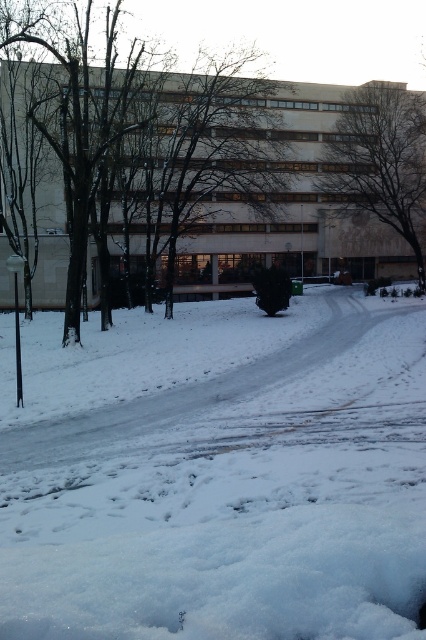
Can you confirm if brown leafless tree at left is positioned to the right of brown textured tree at upper center?

In fact, brown leafless tree at left is to the left of brown textured tree at upper center.

The height and width of the screenshot is (640, 426). Describe the element at coordinates (75, 118) in the screenshot. I see `brown leafless tree at left` at that location.

Locate an element on the screen. The width and height of the screenshot is (426, 640). brown leafless tree at left is located at coordinates (75, 118).

The image size is (426, 640). Identify the location of brown leafless tree at left. (75, 118).

Between white fluffy snow at center and brown leafless tree at left, which one has less height?

With less height is white fluffy snow at center.

Between point (14, 634) and point (72, 4), which one is positioned behind?

Positioned behind is point (72, 4).

Identify the location of white fluffy snow at center. (218, 474).

Does white fluffy snow at center have a lesser height compared to brown textured tree at upper center?

Indeed, white fluffy snow at center has a lesser height compared to brown textured tree at upper center.

Is point (400, 554) behind point (389, 124)?

No, (400, 554) is in front of (389, 124).

I want to click on white fluffy snow at center, so click(x=218, y=474).